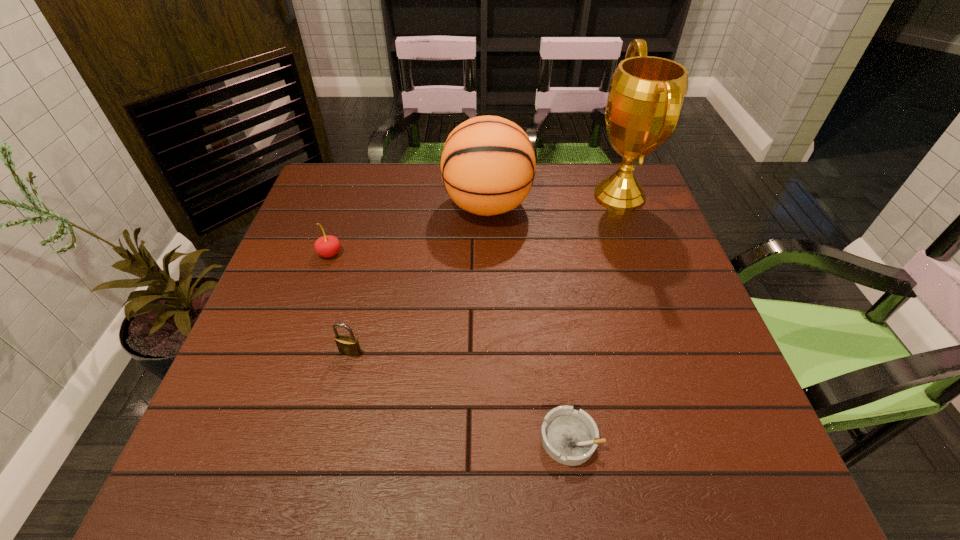
Find the location of a particular element. This screenshot has width=960, height=540. free spot that satisfies the following two spatial constraints: 1. on the back side of the fourth tallest object; 2. on the left side of the basketball is located at coordinates (386, 206).